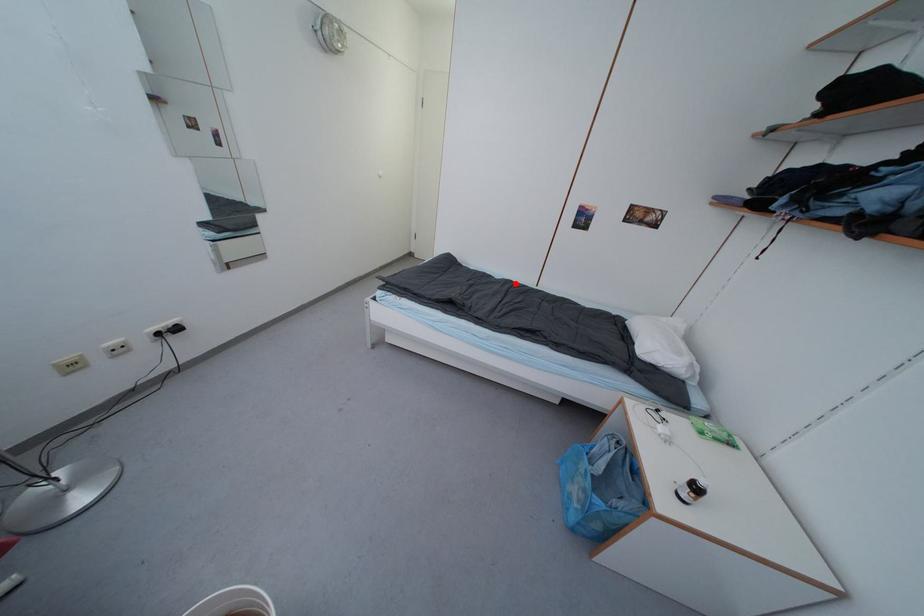
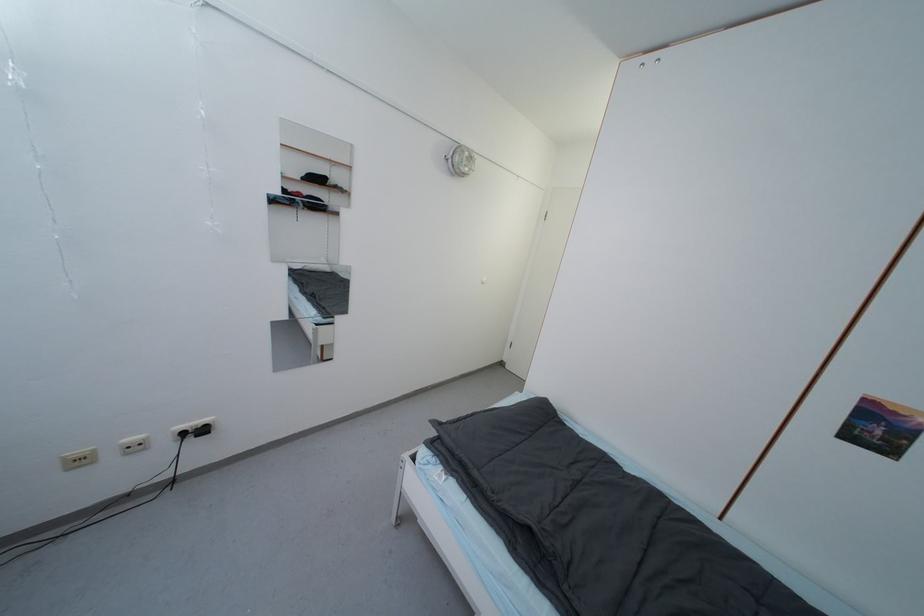
In the second image, find the point that corresponds to the highlighted location in the first image.

(664, 496)